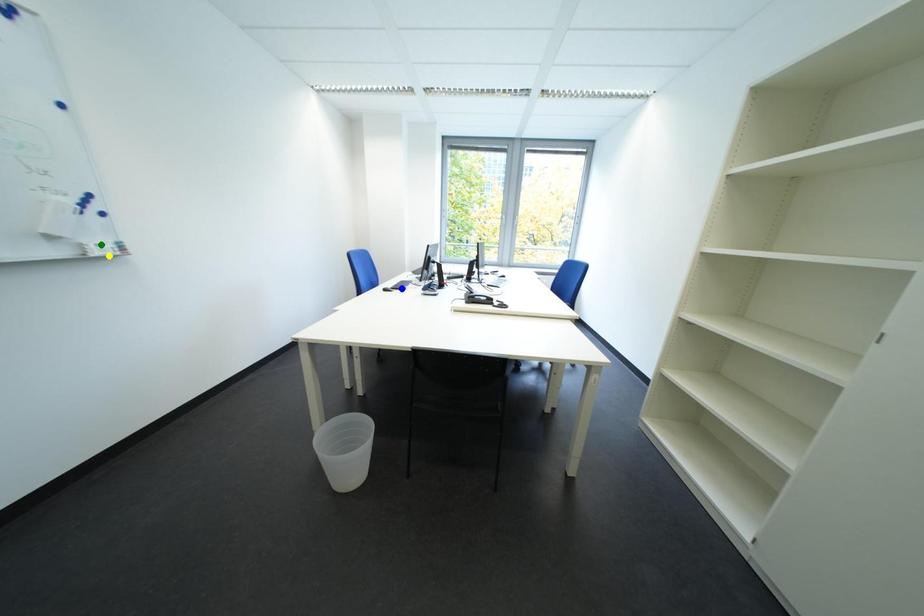
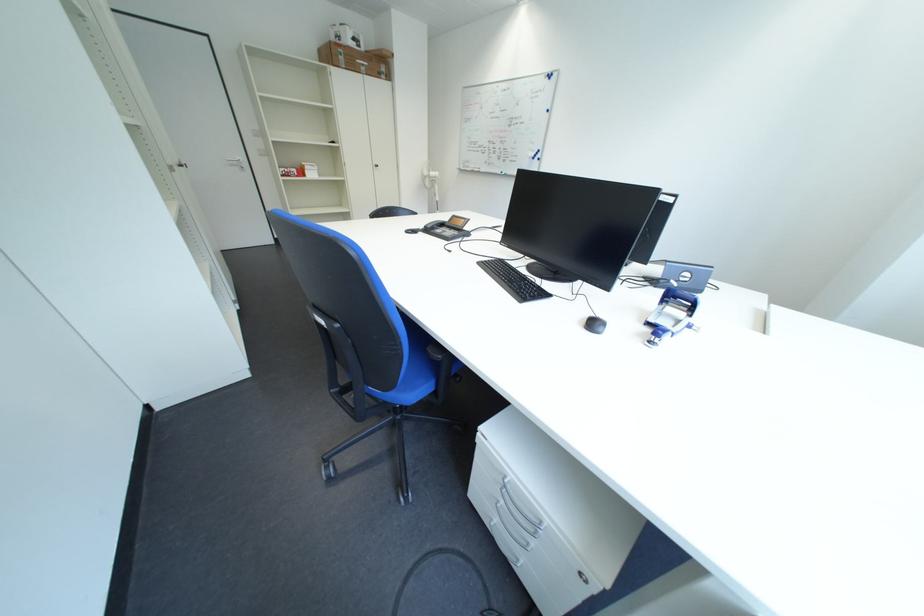
I am providing you with two images of the same scene from different viewpoints. Three points are marked in image1. Which point corresponds to a part or object that is occluded in image2?In image1, three points are marked. Which of them correspond to a part or object that is occluded in image2?Among the three points shown in image1, which one corresponds to a part or object that is no longer visible due to occlusion in image2?

Invisible in image2: yellow point, blue point, green point.